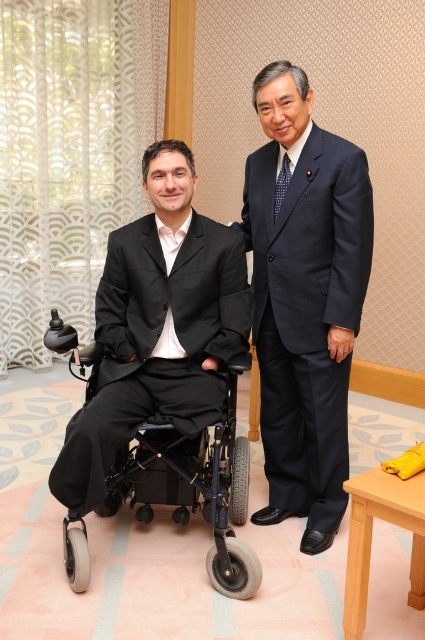
Does dark blue suit at center appear on the right side of matte black suit at center?

Correct, you'll find dark blue suit at center to the right of matte black suit at center.

Can you confirm if dark blue suit at center is bigger than matte black suit at center?

Yes, dark blue suit at center is bigger than matte black suit at center.

Is point (312, 244) behind point (173, 401)?

Yes.

Identify the location of dark blue suit at center. (305, 298).

Describe the element at coordinates (158, 326) in the screenshot. I see `matte black suit at center` at that location.

Between matte black suit at center and black plastic wheelchair at left, which one appears on the right side from the viewer's perspective?

black plastic wheelchair at left

Locate an element on the screen. matte black suit at center is located at coordinates tap(158, 326).

Who is higher up, dark blue suit at center or black plastic wheelchair at left?

dark blue suit at center

In order to click on dark blue suit at center in this screenshot , I will do `click(305, 298)`.

Locate an element on the screen. Image resolution: width=425 pixels, height=640 pixels. dark blue suit at center is located at coordinates (305, 298).